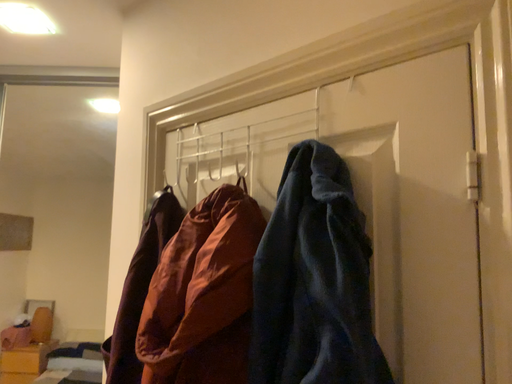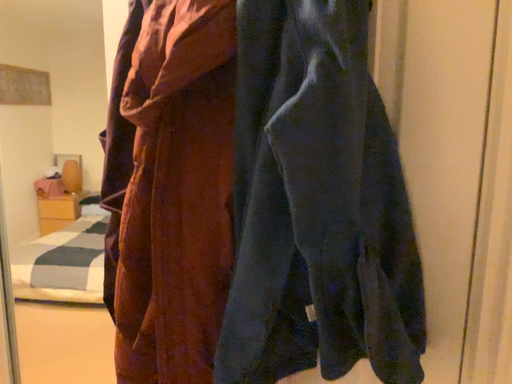
Question: How did the camera likely rotate when shooting the video?

Choices:
 (A) rotated upward
 (B) rotated downward

Answer: (B)